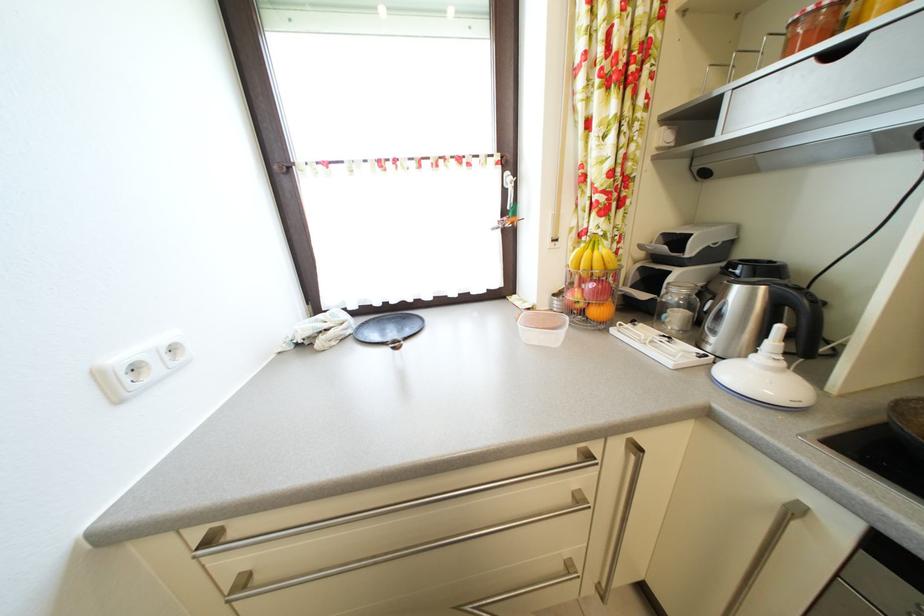
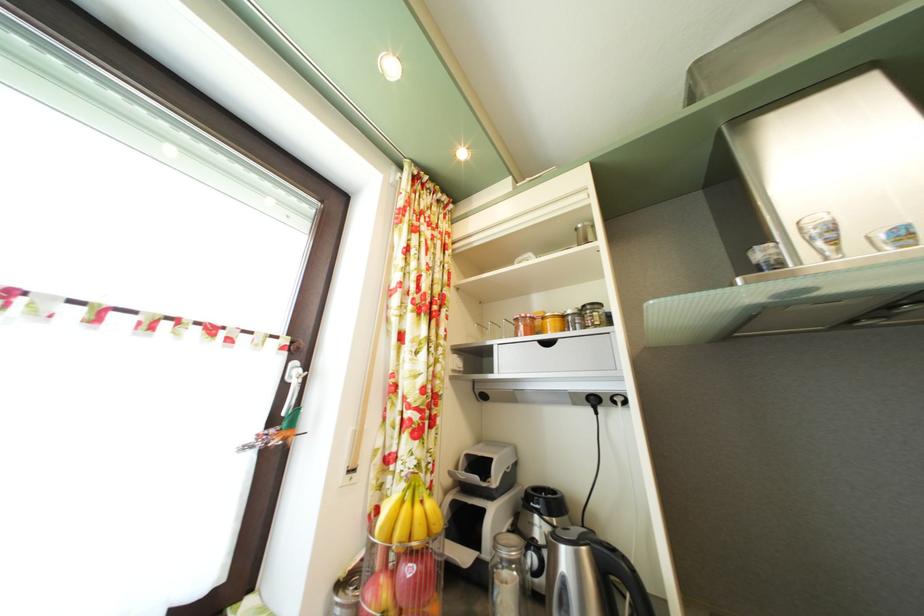
Locate, in the second image, the point that corresponds to point 516,180 in the first image.

(304, 371)